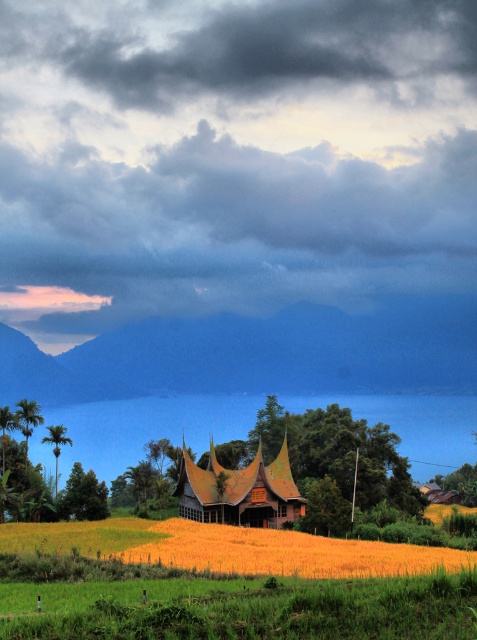
Is yellow grassy field at center smaller than green leafy palm tree at left?

No, yellow grassy field at center is not smaller than green leafy palm tree at left.

Who is more forward, (155,522) or (21,416)?

Point (155,522) is more forward.

The height and width of the screenshot is (640, 477). Identify the location of yellow grassy field at center. point(276,552).

Which is more to the left, wooden hut at center or green leafy palm tree at left?

Positioned to the left is green leafy palm tree at left.

Can you confirm if wooden hut at center is smaller than green leafy palm tree at left?

Actually, wooden hut at center might be larger than green leafy palm tree at left.

Which is behind, point (214, 472) or point (26, 456)?

Positioned behind is point (26, 456).

Identify the location of wooden hut at center. The height and width of the screenshot is (640, 477). (238, 492).

Identify the location of green leafy palm tree at left. The width and height of the screenshot is (477, 640). (28, 417).

The width and height of the screenshot is (477, 640). In order to click on green leafy palm tree at left in this screenshot , I will do `click(28, 417)`.